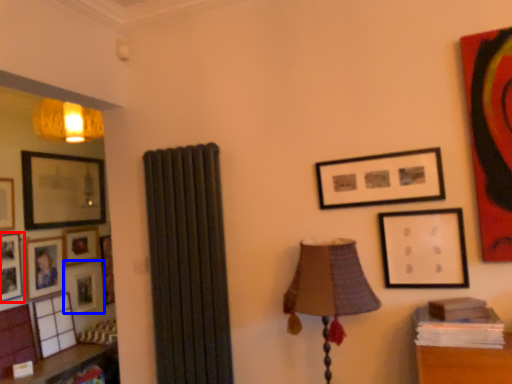
Question: Which of the following is the closest to the observer, picture frame (highlighted by a red box) or picture frame (highlighted by a blue box)?

Choices:
 (A) picture frame
 (B) picture frame

Answer: (A)